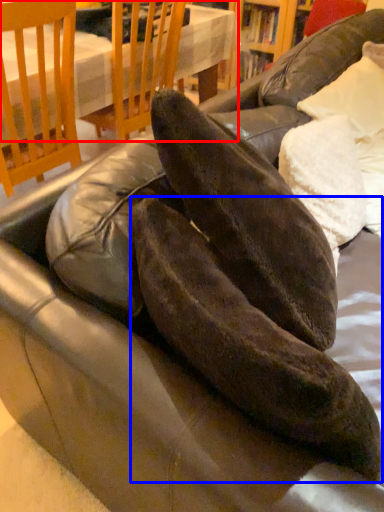
Question: Among these objects, which one is farthest to the camera, table (highlighted by a red box) or leather shoe (highlighted by a blue box)?

Choices:
 (A) table
 (B) leather shoe

Answer: (A)